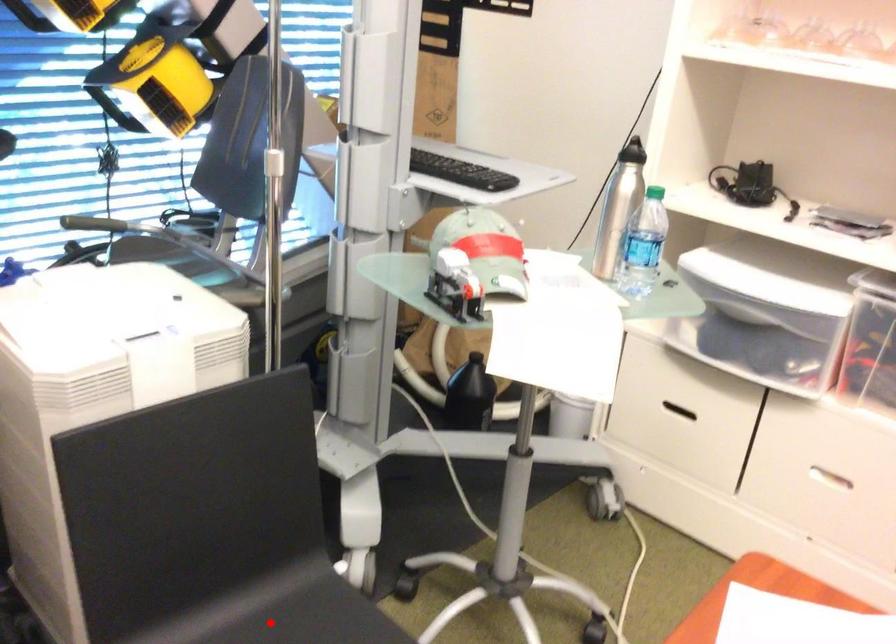
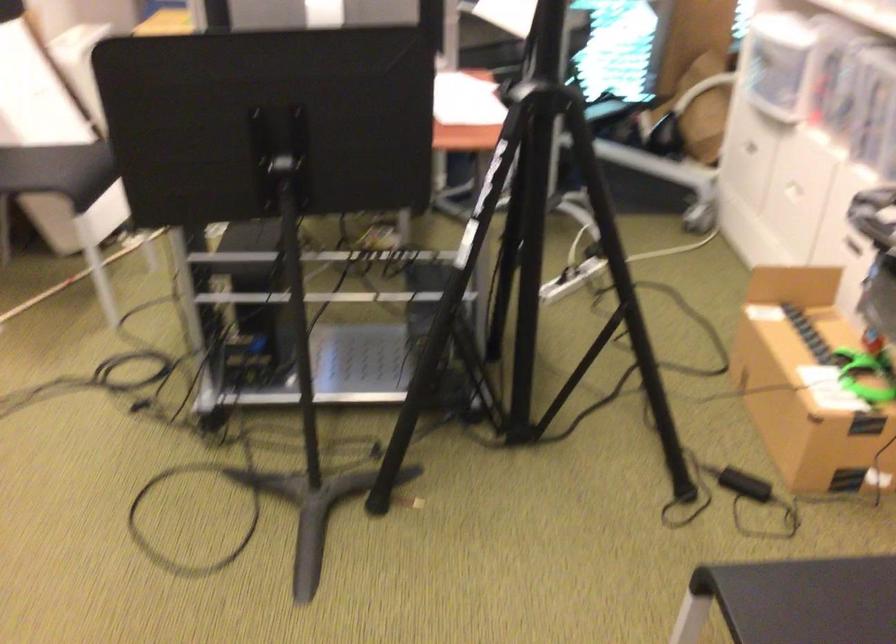
Question: I am providing you with two images of the same scene from different viewpoints. A red point is marked on the first image. Is the red point's position out of view in image 2?

Choices:
 (A) Yes
 (B) No

Answer: (A)